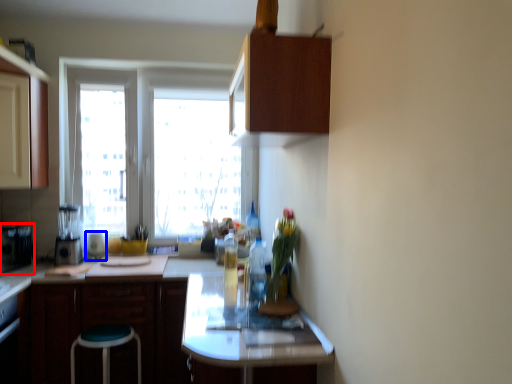
Question: Which point is further to the camera, appliance (highlighted by a red box) or appliance (highlighted by a blue box)?

Choices:
 (A) appliance
 (B) appliance

Answer: (B)